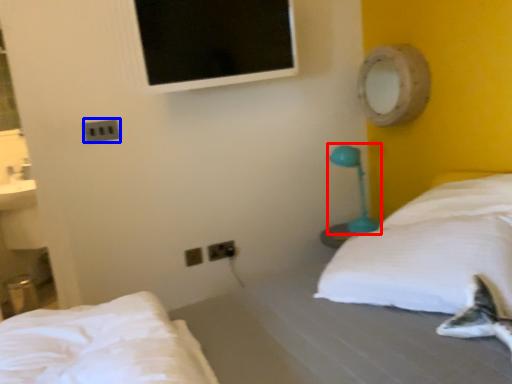
Question: Among these objects, which one is farthest to the camera, table lamp (highlighted by a red box) or electric outlet (highlighted by a blue box)?

Choices:
 (A) table lamp
 (B) electric outlet

Answer: (A)